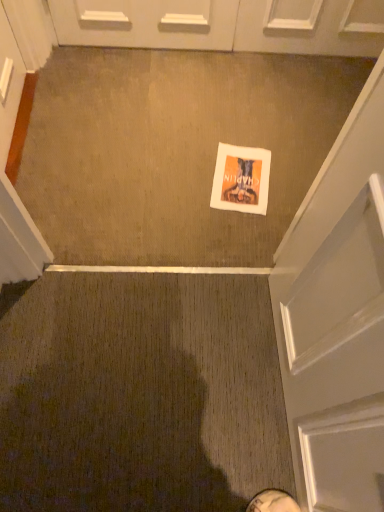
Question: Can you confirm if white paper flyer at center is wider than white glossy door at upper center?

Choices:
 (A) yes
 (B) no

Answer: (A)

Question: Is white paper flyer at center at the right side of white glossy door at upper center?

Choices:
 (A) yes
 (B) no

Answer: (A)

Question: Can you confirm if white paper flyer at center is taller than white glossy door at upper center?

Choices:
 (A) no
 (B) yes

Answer: (A)

Question: Is white paper flyer at center completely or partially outside of white glossy door at upper center?

Choices:
 (A) no
 (B) yes

Answer: (B)

Question: Does white paper flyer at center have a larger size compared to white glossy door at upper center?

Choices:
 (A) yes
 (B) no

Answer: (B)

Question: From the image's perspective, is white leather shoe at lower center above or below white glossy door at upper center?

Choices:
 (A) below
 (B) above

Answer: (A)

Question: In terms of width, does white leather shoe at lower center look wider or thinner when compared to white glossy door at upper center?

Choices:
 (A) wide
 (B) thin

Answer: (A)

Question: Considering the positions of point (286, 495) and point (370, 27), is point (286, 495) closer or farther from the camera than point (370, 27)?

Choices:
 (A) closer
 (B) farther

Answer: (A)

Question: Choose the correct answer: Is white leather shoe at lower center inside white glossy door at upper center or outside it?

Choices:
 (A) outside
 (B) inside

Answer: (A)

Question: Considering the relative positions of white paper flyer at center and white leather shoe at lower center in the image provided, is white paper flyer at center to the left or to the right of white leather shoe at lower center?

Choices:
 (A) right
 (B) left

Answer: (B)

Question: From a real-world perspective, is white paper flyer at center physically located above or below white leather shoe at lower center?

Choices:
 (A) above
 (B) below

Answer: (B)

Question: Is white paper flyer at center in front of or behind white leather shoe at lower center in the image?

Choices:
 (A) front
 (B) behind

Answer: (B)

Question: In terms of height, does white paper flyer at center look taller or shorter compared to white leather shoe at lower center?

Choices:
 (A) short
 (B) tall

Answer: (A)

Question: In terms of width, does white glossy door at upper center look wider or thinner when compared to white leather shoe at lower center?

Choices:
 (A) wide
 (B) thin

Answer: (B)

Question: Relative to white leather shoe at lower center, is white glossy door at upper center in front or behind?

Choices:
 (A) front
 (B) behind

Answer: (B)